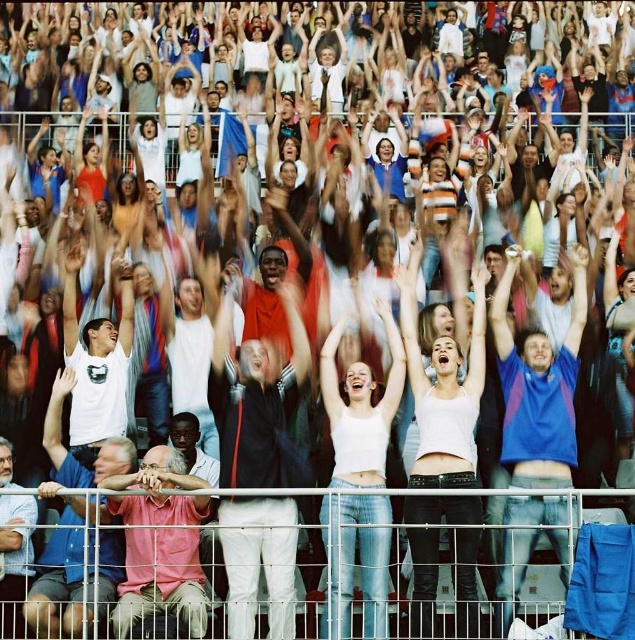
Question: In this image, where is black matte jacket at center located relative to blue cotton shirt at center?

Choices:
 (A) right
 (B) left

Answer: (B)

Question: Can you confirm if white tank top at center is wider than pink cotton shirt at lower left?

Choices:
 (A) no
 (B) yes

Answer: (B)

Question: Which object is the farthest from the blue cotton shirt at center?

Choices:
 (A) pink cotton shirt at lower left
 (B) black matte jacket at center

Answer: (A)

Question: Which point is closer to the camera?

Choices:
 (A) white tank top at center
 (B) pink cotton shirt at lower left
 (C) white cotton tank top at center
 (D) black matte jacket at center

Answer: (B)

Question: Does blue cotton shirt at center have a smaller size compared to pink cotton shirt at lower left?

Choices:
 (A) yes
 (B) no

Answer: (B)

Question: Which point is farther to the camera?

Choices:
 (A) black matte jacket at center
 (B) white tank top at center
 (C) white cotton tank top at center

Answer: (B)